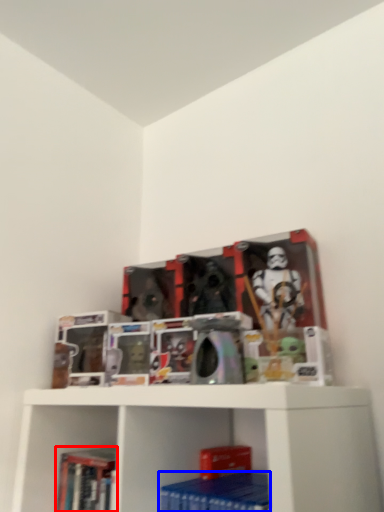
Question: Among these objects, which one is nearest to the camera, book (highlighted by a red box) or paperback book (highlighted by a blue box)?

Choices:
 (A) book
 (B) paperback book

Answer: (B)